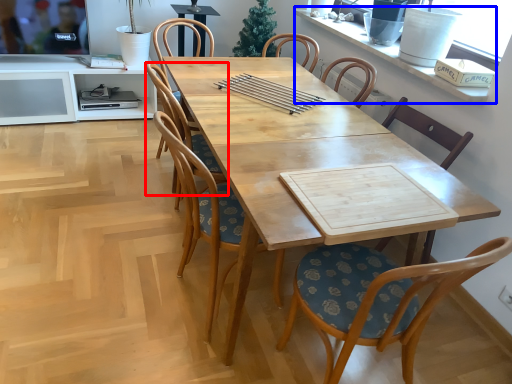
Question: Which of the following is the farthest to the observer, chair (highlighted by a red box) or window sill (highlighted by a blue box)?

Choices:
 (A) chair
 (B) window sill

Answer: (A)